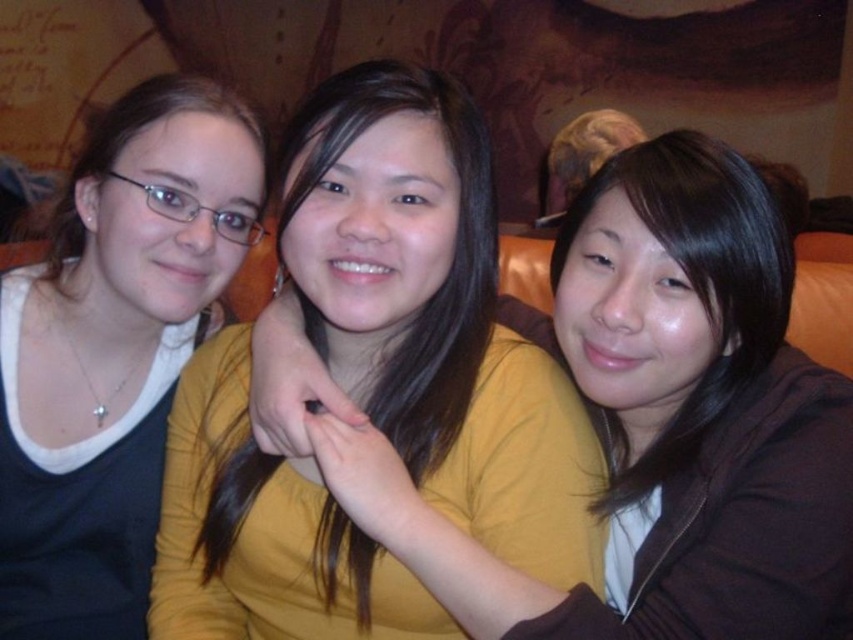
You are a photographer trying to capture a group photo of the yellow matte shirt at center and the matte black shirt at left. The camera you are using has a limited focus range. Can you determine which of the two shirts is wider to ensure proper framing?

The yellow matte shirt at center might be wider than matte black shirt at left, so it would be better to frame the yellow matte shirt at center first to ensure it fits within the camera focus range.

You are sitting at a table in a cozy indoor space with a warm wall mural behind you. You see a yellow matte shirt at center and a matte black shirt at left. Which shirt is positioned closer to your left side?

The matte black shirt at left is positioned closer to your left side since it is to the left of the yellow matte shirt at center.